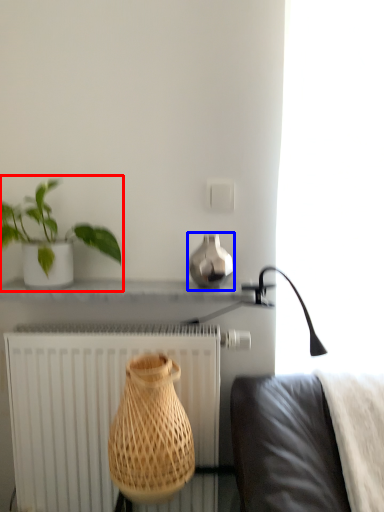
Question: Which object appears farthest to the camera in this image, houseplant (highlighted by a red box) or vase (highlighted by a blue box)?

Choices:
 (A) houseplant
 (B) vase

Answer: (B)